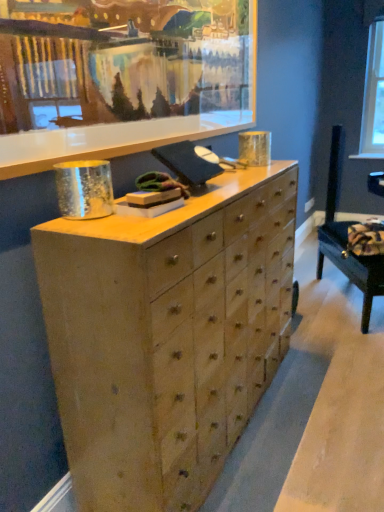
Question: Is natural wood chest of drawers at center to the left or to the right of wooden picture frame at upper center in the image?

Choices:
 (A) left
 (B) right

Answer: (B)

Question: From their relative heights in the image, would you say natural wood chest of drawers at center is taller or shorter than wooden picture frame at upper center?

Choices:
 (A) short
 (B) tall

Answer: (B)

Question: Considering the real-world distances, which object is closest to the natural wood chest of drawers at center?

Choices:
 (A) clear glass window screen at upper right
 (B) wooden picture frame at upper center
 (C) velvet dark blue swivel chair at lower right

Answer: (B)

Question: Estimate the real-world distances between objects in this image. Which object is farther from the wooden picture frame at upper center?

Choices:
 (A) velvet dark blue swivel chair at lower right
 (B) clear glass window screen at upper right
 (C) natural wood chest of drawers at center

Answer: (B)